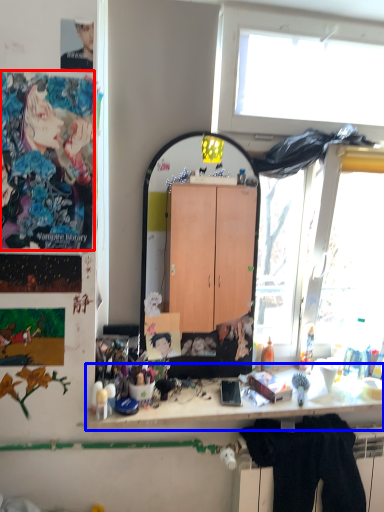
Question: Which of the following is the farthest to the observer, person (highlighted by a red box) or desk (highlighted by a blue box)?

Choices:
 (A) person
 (B) desk

Answer: (B)